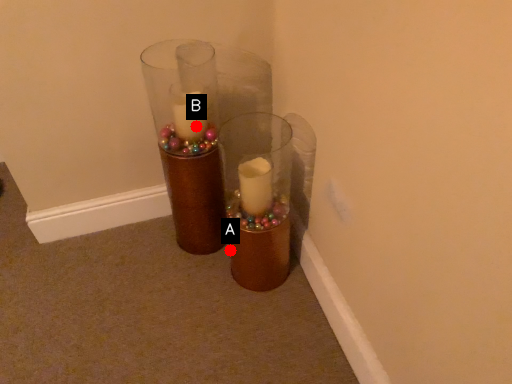
Question: Two points are circled on the image, labeled by A and B beside each circle. Which point is closer to the camera?

Choices:
 (A) A is closer
 (B) B is closer

Answer: (B)